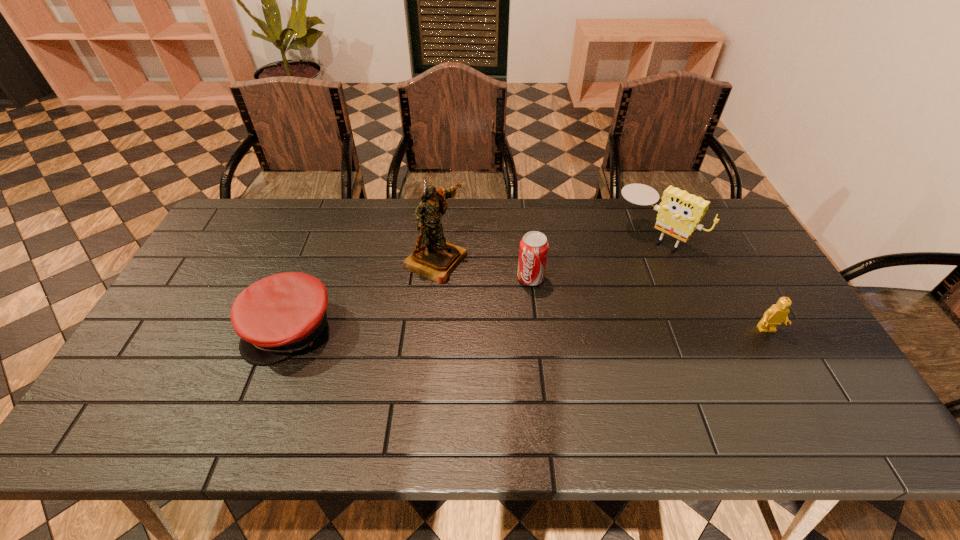
Locate an element on the screen. sponge present at the far edge is located at coordinates (679, 213).

Where is `object that is at the right edge`? Image resolution: width=960 pixels, height=540 pixels. object that is at the right edge is located at coordinates (778, 313).

Where is `vacant space at the far edge of the desktop`? The height and width of the screenshot is (540, 960). vacant space at the far edge of the desktop is located at coordinates (570, 225).

Where is `free location at the near edge`? free location at the near edge is located at coordinates [x=544, y=376].

I want to click on vacant area at the right edge, so click(x=722, y=249).

I want to click on free space at the far left corner of the desktop, so click(x=226, y=222).

The width and height of the screenshot is (960, 540). I want to click on free space at the near left corner, so click(x=141, y=389).

Where is `empty space that is in between the soda can and the fourth shortest object`? empty space that is in between the soda can and the fourth shortest object is located at coordinates (591, 258).

This screenshot has height=540, width=960. I want to click on vacant area between the cap and the fourth object from left to right, so click(471, 283).

Locate an element on the screen. The height and width of the screenshot is (540, 960). free point between the third shortest object and the cap is located at coordinates (411, 303).